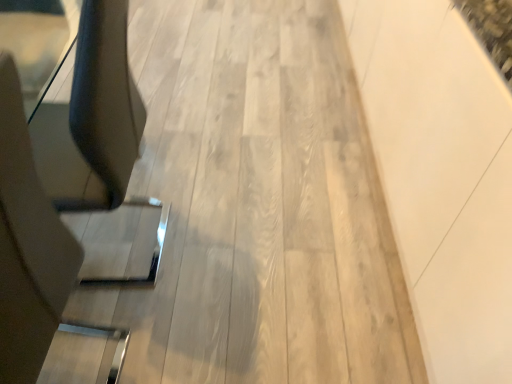
Measure the distance between point (5, 308) and camera.

A distance of 28.31 inches exists between point (5, 308) and camera.

This screenshot has width=512, height=384. What do you see at coordinates (28, 246) in the screenshot?
I see `matte black swivel chair at left` at bounding box center [28, 246].

In order to click on matte black swivel chair at left in this screenshot , I will do `click(28, 246)`.

Image resolution: width=512 pixels, height=384 pixels. Find the location of `matte black swivel chair at left`. matte black swivel chair at left is located at coordinates (28, 246).